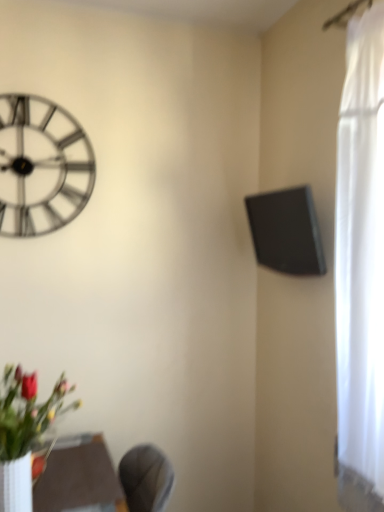
Question: Can you confirm if metallic silver clock at upper left is wider than matte brown table at lower center?

Choices:
 (A) yes
 (B) no

Answer: (B)

Question: Does metallic silver clock at upper left contain matte brown table at lower center?

Choices:
 (A) yes
 (B) no

Answer: (B)

Question: Is metallic silver clock at upper left turned away from matte brown table at lower center?

Choices:
 (A) no
 (B) yes

Answer: (A)

Question: Would you say metallic silver clock at upper left is a long distance from matte brown table at lower center?

Choices:
 (A) yes
 (B) no

Answer: (A)

Question: Does metallic silver clock at upper left turn towards matte brown table at lower center?

Choices:
 (A) no
 (B) yes

Answer: (A)

Question: From a real-world perspective, relative to black matte speaker at upper right, is matte brown table at lower center vertically above or below?

Choices:
 (A) below
 (B) above

Answer: (A)

Question: In terms of size, does matte brown table at lower center appear bigger or smaller than black matte speaker at upper right?

Choices:
 (A) big
 (B) small

Answer: (A)

Question: Relative to black matte speaker at upper right, is matte brown table at lower center in front or behind?

Choices:
 (A) front
 (B) behind

Answer: (A)

Question: Is matte brown table at lower center situated inside black matte speaker at upper right or outside?

Choices:
 (A) inside
 (B) outside

Answer: (B)

Question: Is metallic silver clock at upper left taller or shorter than black matte speaker at upper right?

Choices:
 (A) tall
 (B) short

Answer: (A)

Question: Is metallic silver clock at upper left inside or outside of black matte speaker at upper right?

Choices:
 (A) inside
 (B) outside

Answer: (B)

Question: Considering their positions, is metallic silver clock at upper left located in front of or behind black matte speaker at upper right?

Choices:
 (A) front
 (B) behind

Answer: (B)

Question: From a real-world perspective, is metallic silver clock at upper left physically located above or below black matte speaker at upper right?

Choices:
 (A) above
 (B) below

Answer: (A)

Question: Do you think black matte speaker at upper right is within matte brown table at lower center, or outside of it?

Choices:
 (A) inside
 (B) outside

Answer: (B)

Question: Relative to matte brown table at lower center, is black matte speaker at upper right in front or behind?

Choices:
 (A) front
 (B) behind

Answer: (B)